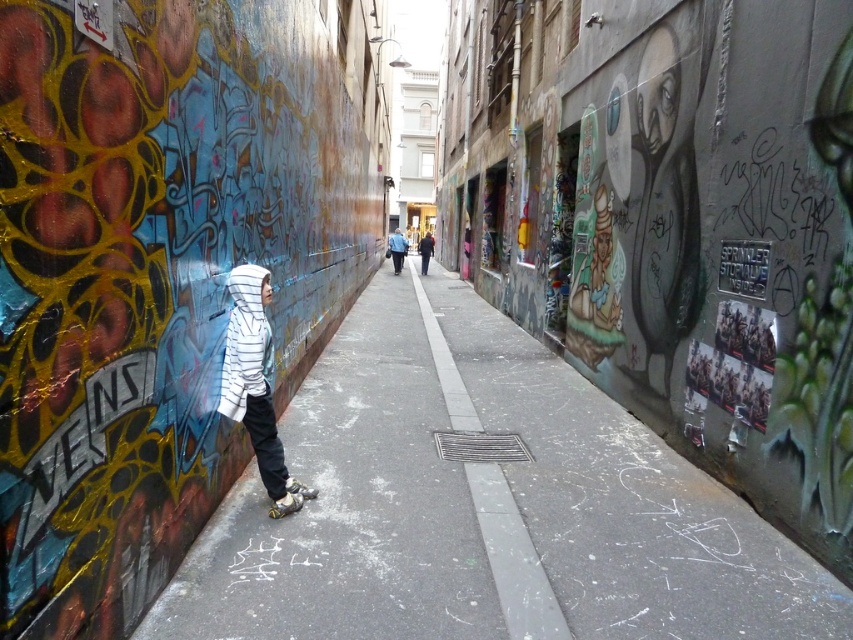
You are a delivery person with a 1.5 meter long box that needs to be placed in the alley. The box must be placed on the smooth asphalt pavement at center and must not extend beyond the matte black skateboard at lower center. Is this possible?

The distance between the smooth asphalt pavement at center and the matte black skateboard at lower center is 1.29 meters. Since the box is 1.5 meters long, it will extend beyond the skateboard, so it is not possible to place the box without exceeding the skateboard area.